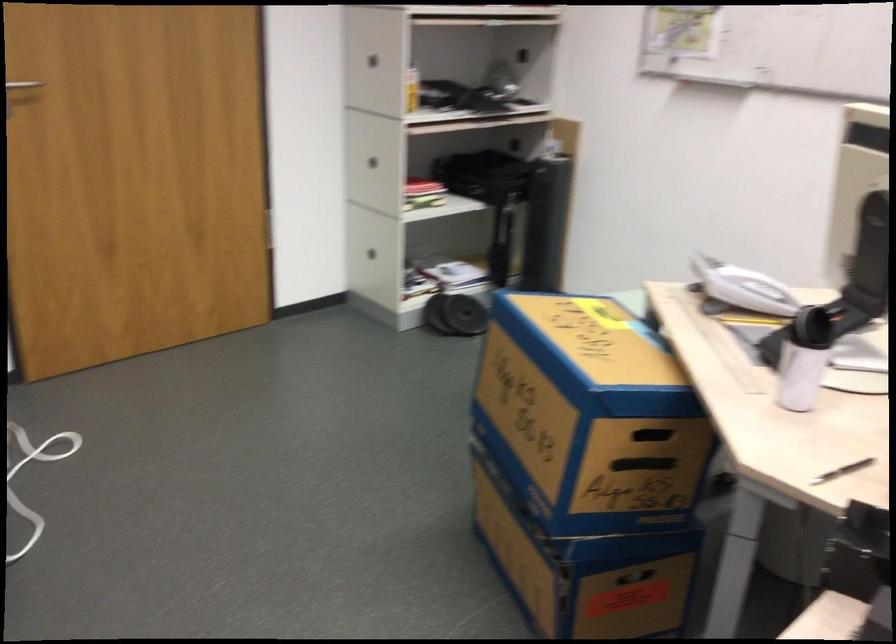
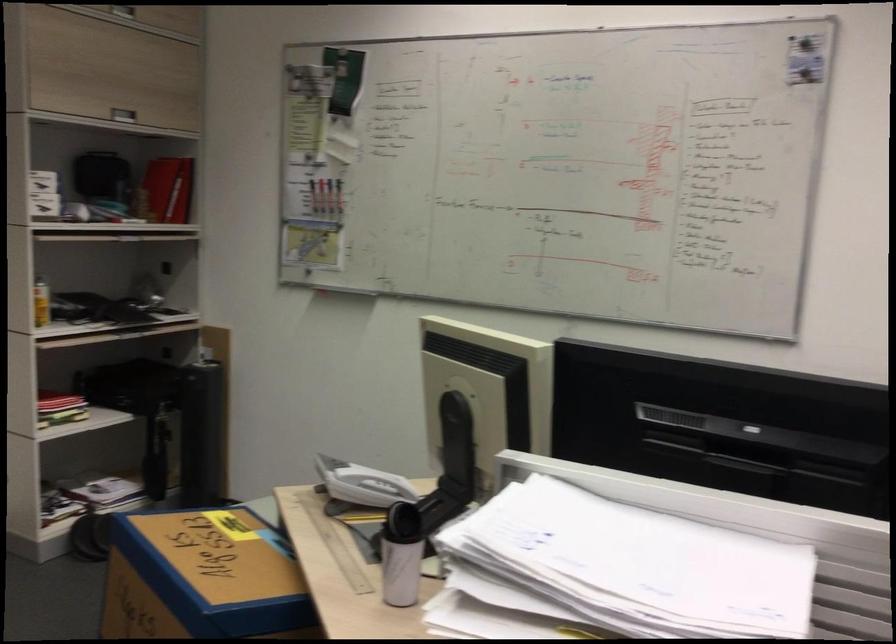
Where in the second image is the point corresponding to point (558, 154) from the first image?

(213, 359)